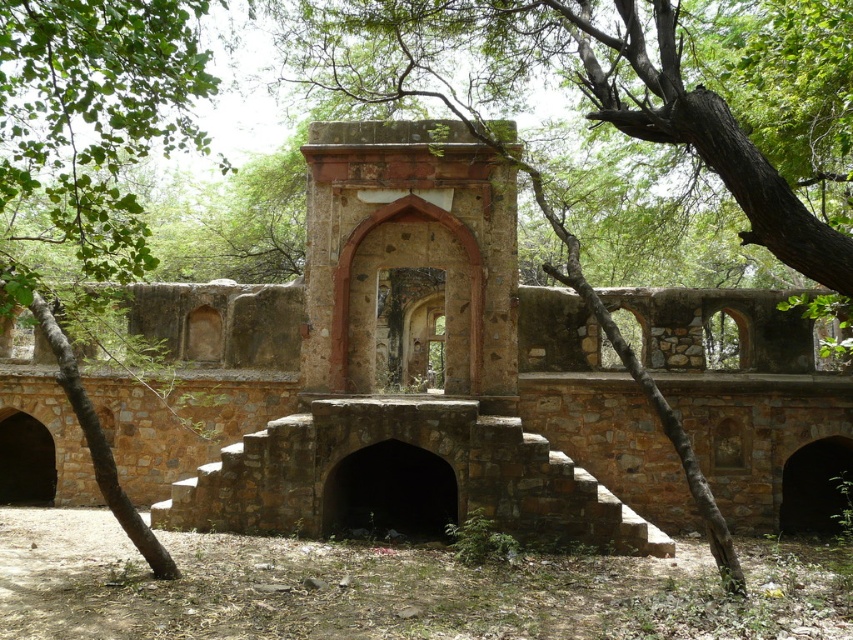
You are an archaeologist exploring the ancient stone structure. You notice the brown stone ruins at center and the green leafy tree at left. From your perspective, which object is positioned to the east?

The green leafy tree at left is positioned to the east because the brown stone ruins at center are to its right.

You are an archaeologist examining the ancient stone structure. You notice the brown stone ruins at center and the brown rough stone arch at center. Which of these two objects is positioned further back in the scene?

The brown rough stone arch at center is positioned further back than the brown stone ruins at center, as it is described as being behind the ruins.